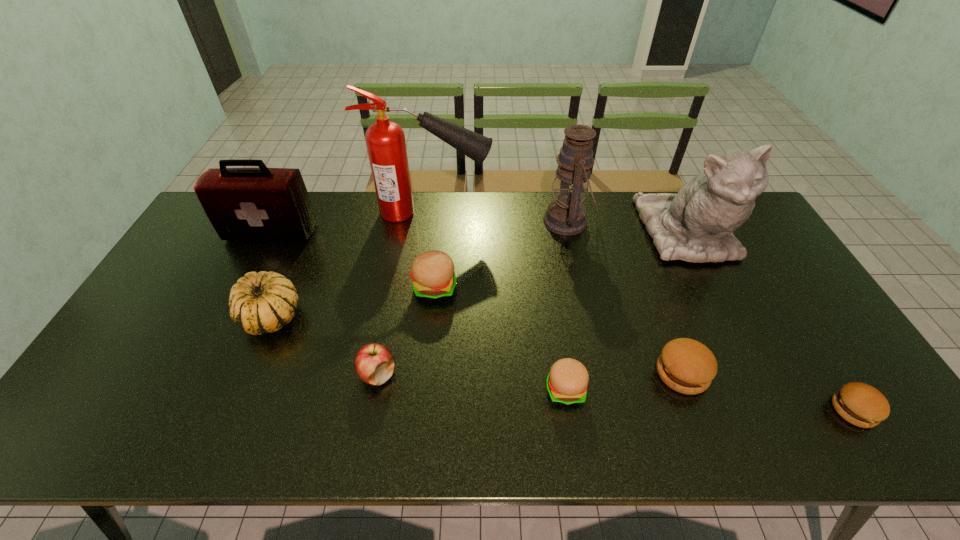
Where is `object that is the eighth nearest to the second hamburger from right to left`? The height and width of the screenshot is (540, 960). object that is the eighth nearest to the second hamburger from right to left is located at coordinates (263, 302).

You are a GUI agent. You are given a task and a screenshot of the screen. Output one action in this format:
    pyautogui.click(x=<x>, y=<y>)
    Task: Click on the hamburger that is the fourth closest to the cat
    The width and height of the screenshot is (960, 540).
    Given the screenshot: What is the action you would take?
    pyautogui.click(x=432, y=272)

Choose which hamburger is the nearest neighbor to the cat. Please provide its 2D coordinates. Your answer should be formatted as a tuple, i.e. [(x, y)], where the tuple contains the x and y coordinates of a point satisfying the conditions above.

[(687, 366)]

At what (x,y) coordinates should I click in order to perform the action: click on free space that satisfies the following two spatial constraints: 1. on the back side of the apple; 2. on the left side of the oil lamp. Please return your answer as a coordinate pair (x, y). Looking at the image, I should click on (406, 221).

Locate an element on the screen. vacant space that satisfies the following two spatial constraints: 1. at the nozzle of the red fire extinguisher; 2. on the side of the red first aid kit with the cross symbol is located at coordinates tap(427, 233).

Locate an element on the screen. This screenshot has height=540, width=960. vacant space that satisfies the following two spatial constraints: 1. on the back side of the blue oil lamp; 2. at the nozzle of the fire extinguisher is located at coordinates (565, 213).

The image size is (960, 540). What are the coordinates of `free space that satisfies the following two spatial constraints: 1. on the side of the left brown hamburger with the cross symbol; 2. on the left side of the seventh shortest object` in the screenshot? It's located at (200, 373).

Where is `free space that satisfies the following two spatial constraints: 1. on the front-facing side of the cat; 2. on the right side of the rightmost hamburger`? This screenshot has width=960, height=540. free space that satisfies the following two spatial constraints: 1. on the front-facing side of the cat; 2. on the right side of the rightmost hamburger is located at coordinates (774, 410).